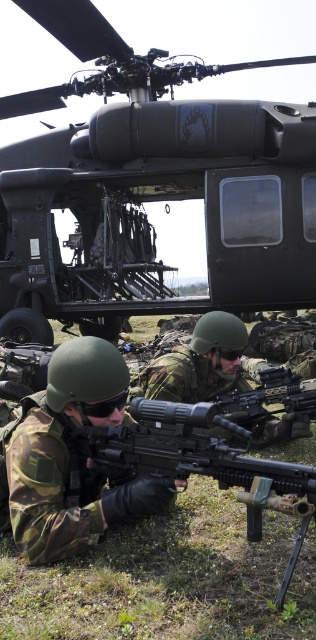
You are a soldier in the scene and need to take cover behind an object. Which object, the matte black helicopter at center or the camouflage uniform at center, is higher and can provide better cover?

The matte black helicopter at center is above the camouflage uniform at center, so it is higher and can provide better cover.